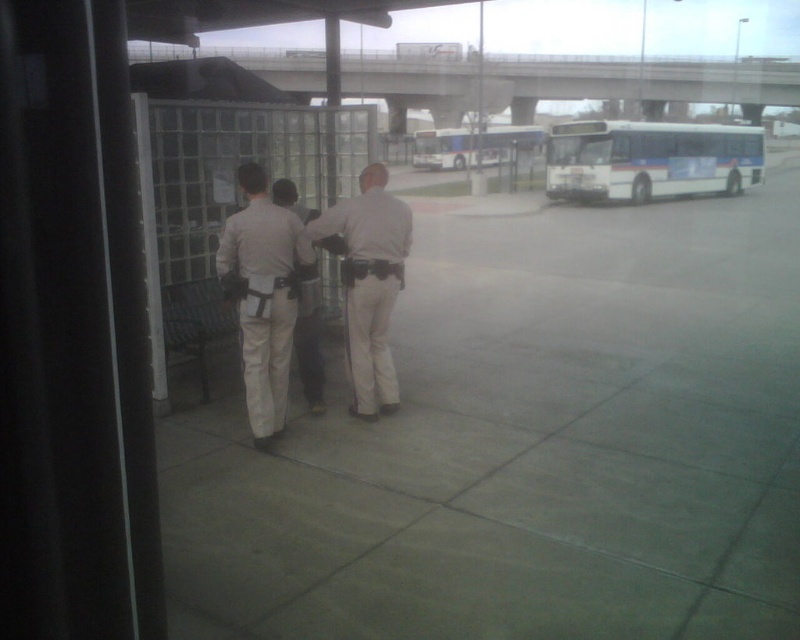
Question: Is tan uniform at center behind white glossy bus at center?

Choices:
 (A) no
 (B) yes

Answer: (A)

Question: Which point appears farthest from the camera in this image?

Choices:
 (A) (312, 404)
 (B) (276, 212)

Answer: (A)

Question: Which object is the closest to the matte concrete sidewalk at center?

Choices:
 (A) white glossy bus at center
 (B) white matte bus at right
 (C) tan uniform at center

Answer: (C)

Question: Which point is farther to the camera?

Choices:
 (A) matte concrete sidewalk at center
 (B) tan uniform at center
 (C) matte khaki pants at center

Answer: (C)

Question: Does matte concrete sidewalk at center appear over tan uniform at center?

Choices:
 (A) no
 (B) yes

Answer: (B)

Question: Can you confirm if matte concrete sidewalk at center is bigger than white glossy bus at center?

Choices:
 (A) no
 (B) yes

Answer: (A)